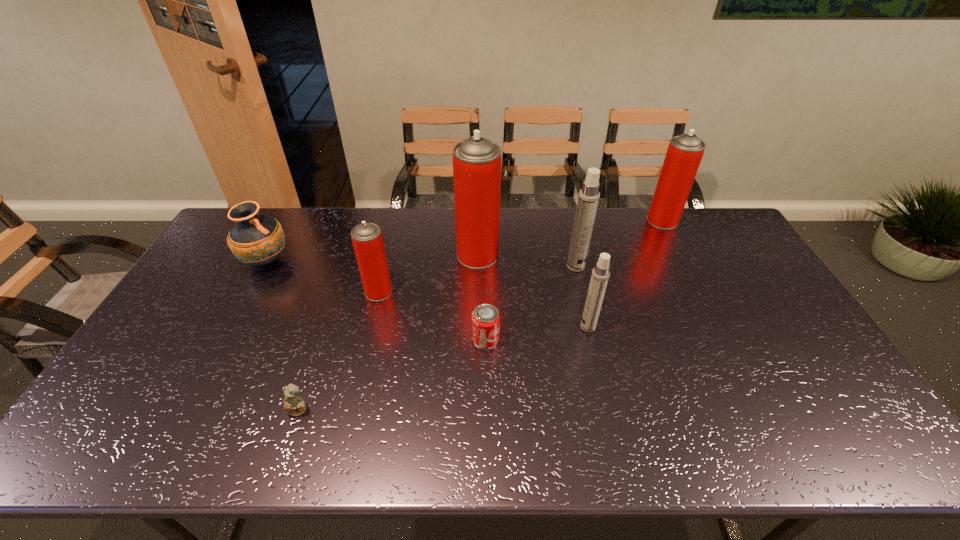
The height and width of the screenshot is (540, 960). I want to click on free space between the smallest red aerosol can and the can, so click(432, 315).

Identify the location of object that can be found as the closest to the smaller white aerosol can. (588, 199).

The height and width of the screenshot is (540, 960). In order to click on object that is the sixth closest one to the second aerosol can from left to right in this screenshot , I will do `click(684, 154)`.

Select which aerosol can appears as the third closest to the farther white aerosol can. Please provide its 2D coordinates. Your answer should be formatted as a tuple, i.e. [(x, y)], where the tuple contains the x and y coordinates of a point satisfying the conditions above.

[(684, 154)]

Identify which aerosol can is the third closest to the bigger white aerosol can. Please provide its 2D coordinates. Your answer should be formatted as a tuple, i.e. [(x, y)], where the tuple contains the x and y coordinates of a point satisfying the conditions above.

[(684, 154)]

The width and height of the screenshot is (960, 540). What are the coordinates of `red aerosol can that is the second nearest to the second smallest red aerosol can` in the screenshot? It's located at coord(367,239).

Locate an element on the screen. red aerosol can that is the third nearest to the bigger white aerosol can is located at coordinates (367, 239).

This screenshot has height=540, width=960. I want to click on free point that satisfies the following two spatial constraints: 1. on the front side of the farther white aerosol can; 2. on the left side of the tallest aerosol can, so tap(477, 266).